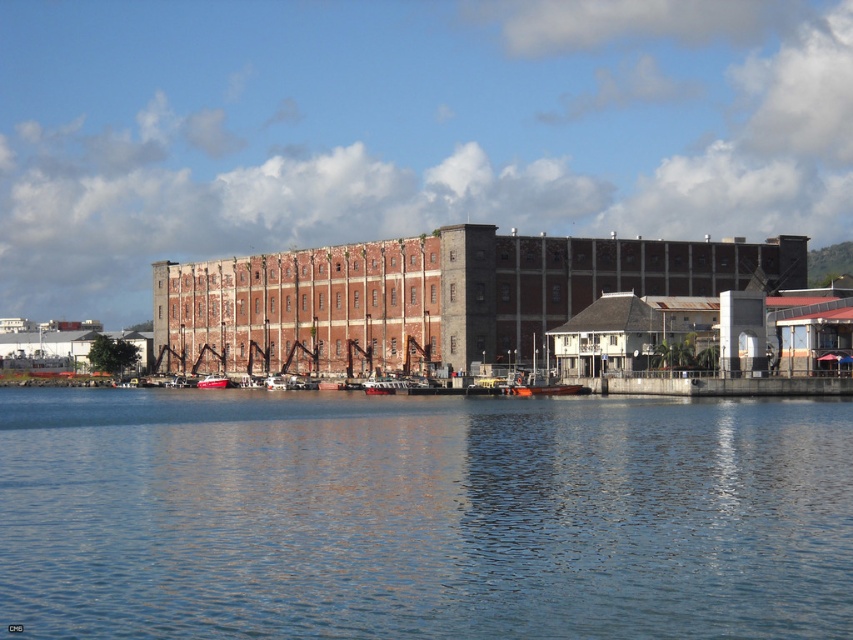
You are standing on the dock and see the blue water at center and the metallic red boat at center. Which object is closer to your right side?

The blue water at center is positioned on the right side of metallic red boat at center, so the blue water at center is closer to your right side.

You are a photographer planning to capture the waterfront scene. You want to ensure that the blue water at center and the metallic red boat at center are both clearly visible in your shot. Based on their sizes, which one should you prioritize framing closer to the edge of the photo to avoid overcrowding?

The blue water at center has a larger width than the metallic red boat at center, so you should prioritize framing the blue water at center closer to the edge of the photo to avoid overcrowding.

You are standing on the dock and see the blue water at center and the metallic red boat at center. Which object is located above the other?

The metallic red boat at center is above the blue water at center because the blue water at center is positioned under the metallic red boat at center.